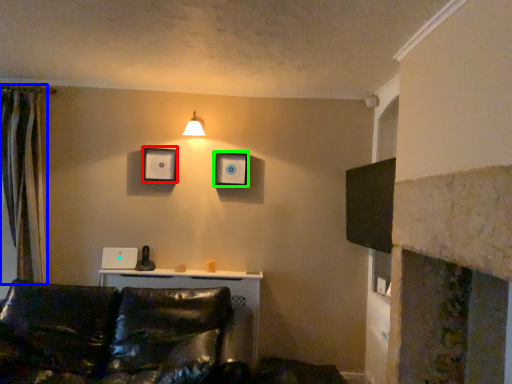
Question: Which object is positioned farthest from picture frame (highlighted by a red box)? Select from curtain (highlighted by a blue box) and picture frame (highlighted by a green box).

Choices:
 (A) curtain
 (B) picture frame

Answer: (A)